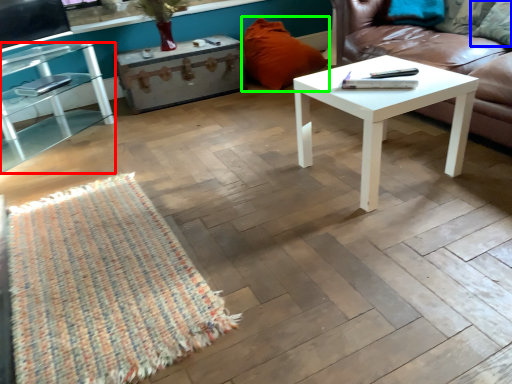
Question: Which is nearer to the table (highlighted by a red box)? pillow (highlighted by a blue box) or pillow (highlighted by a green box).

Choices:
 (A) pillow
 (B) pillow

Answer: (B)